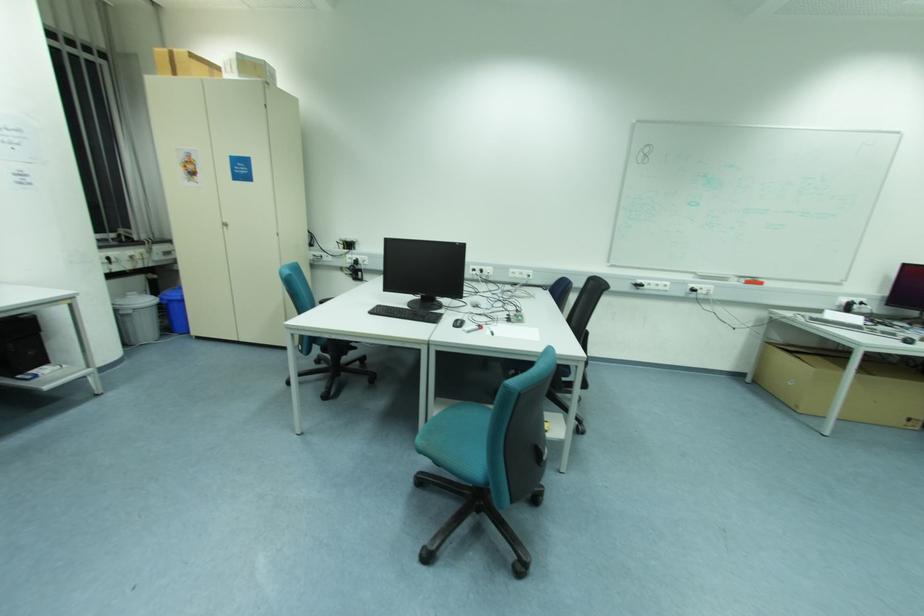
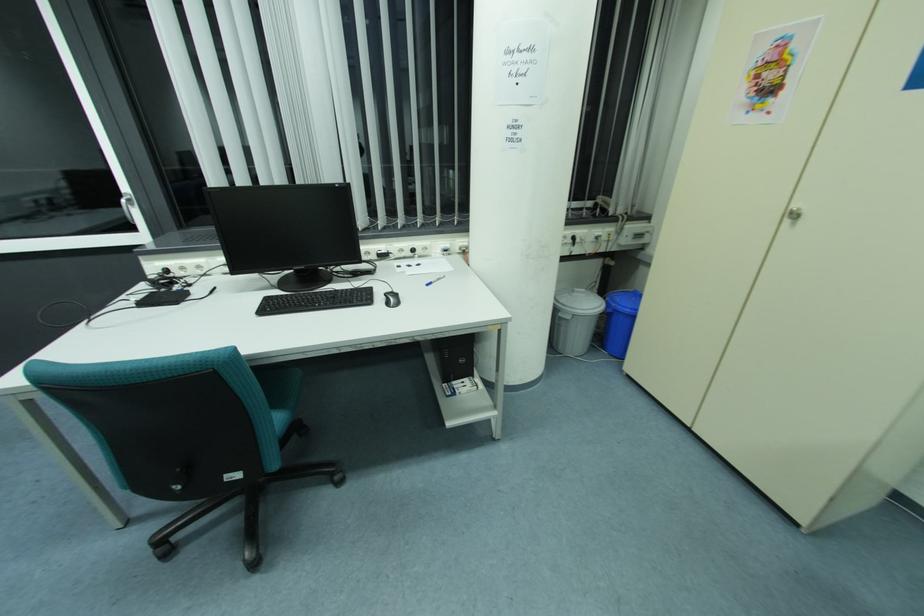
Find the pixel in the second image that matches point 130,312 in the first image.

(568, 318)